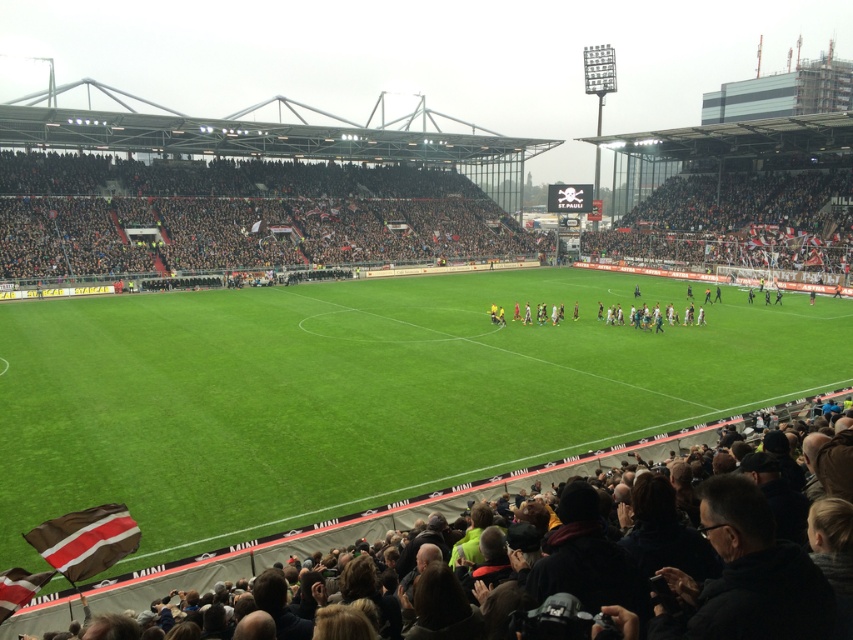
Question: In this image, where is dark gray fabric crowd at lower center located relative to striped fabric flag at lower left?

Choices:
 (A) below
 (B) above

Answer: (B)

Question: Which of these objects is positioned farthest from the dark gray fabric crowd at lower center?

Choices:
 (A) brown striped fabric at lower left
 (B) striped fabric flag at lower left

Answer: (B)

Question: Among these objects, which one is nearest to the camera?

Choices:
 (A) dark gray fabric crowd at lower center
 (B) brown striped fabric at lower left

Answer: (B)

Question: Considering the relative positions of dark gray fabric crowd at lower center and brown striped fabric at lower left in the image provided, where is dark gray fabric crowd at lower center located with respect to brown striped fabric at lower left?

Choices:
 (A) left
 (B) right

Answer: (B)

Question: Is dark gray fabric crowd at lower center positioned behind brown striped fabric at lower left?

Choices:
 (A) no
 (B) yes

Answer: (B)

Question: Estimate the real-world distances between objects in this image. Which object is farther from the striped fabric flag at lower left?

Choices:
 (A) brown striped fabric at lower left
 (B) dark gray fabric crowd at lower center

Answer: (B)